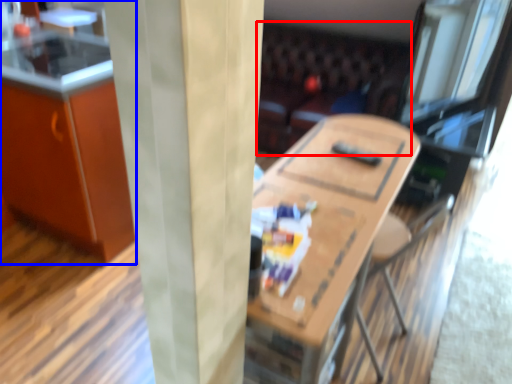
Question: Which of the following is the closest to the observer, couch (highlighted by a red box) or cabinetry (highlighted by a blue box)?

Choices:
 (A) couch
 (B) cabinetry

Answer: (B)